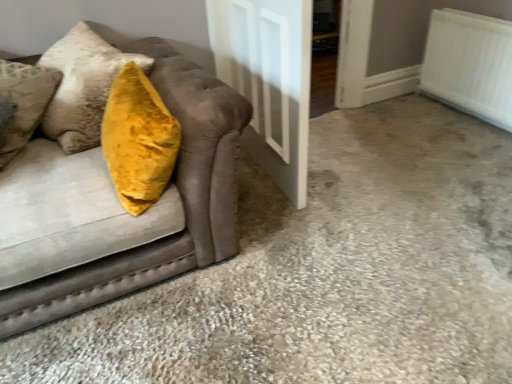
Question: Relative to velvet mustard pillow at left, is white glossy door at center in front or behind?

Choices:
 (A) behind
 (B) front

Answer: (A)

Question: Is point (283, 66) positioned closer to the camera than point (47, 195)?

Choices:
 (A) closer
 (B) farther

Answer: (B)

Question: Which is farther from the white textured radiator at upper right?

Choices:
 (A) white glossy door at center
 (B) velvet mustard pillow at left

Answer: (B)

Question: Considering the real-world distances, which object is closest to the white glossy door at center?

Choices:
 (A) white textured radiator at upper right
 (B) velvet mustard pillow at left

Answer: (B)